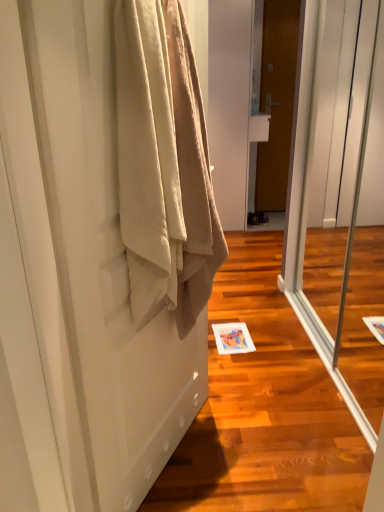
What are the coordinates of `free space to the right of beige fabric door at left, which is the first door in left-to-right order` in the screenshot? It's located at (262, 452).